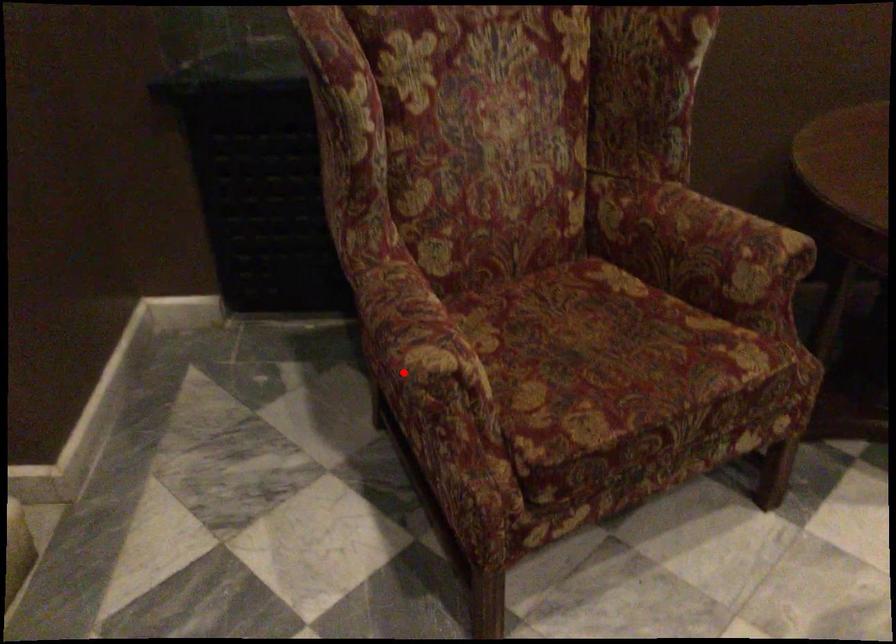
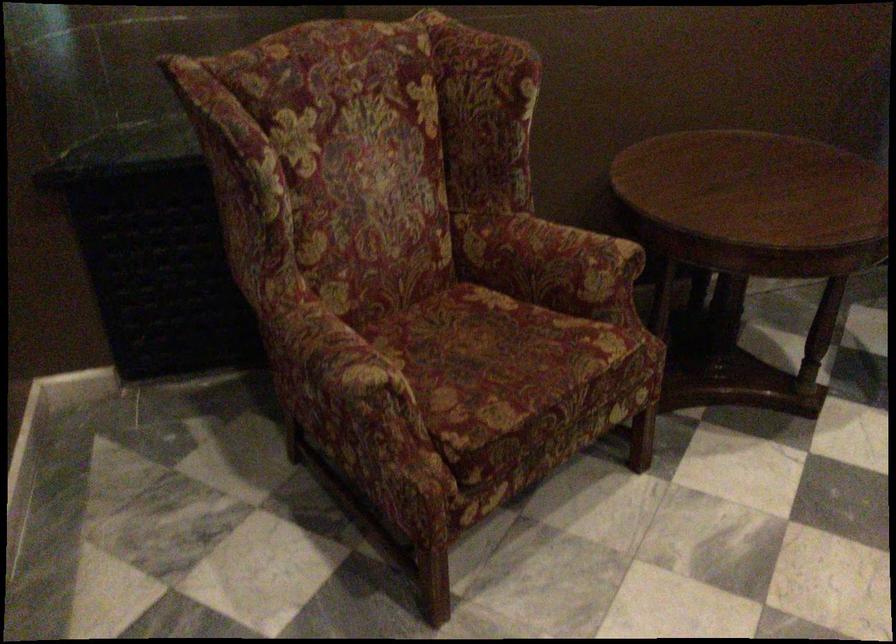
Locate, in the second image, the point that corresponds to the highlighted location in the first image.

(343, 389)